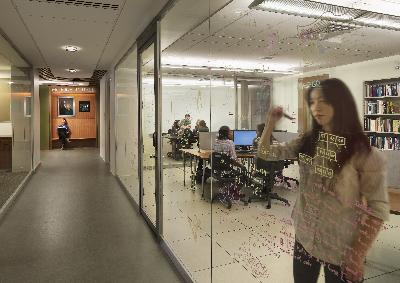
At what (x,y) coordinates should I click in order to perform the action: click on glass wall. Please return your answer as a coordinate pair (x, y). Looking at the image, I should click on (246, 105), (186, 104), (151, 110), (127, 113), (11, 134).